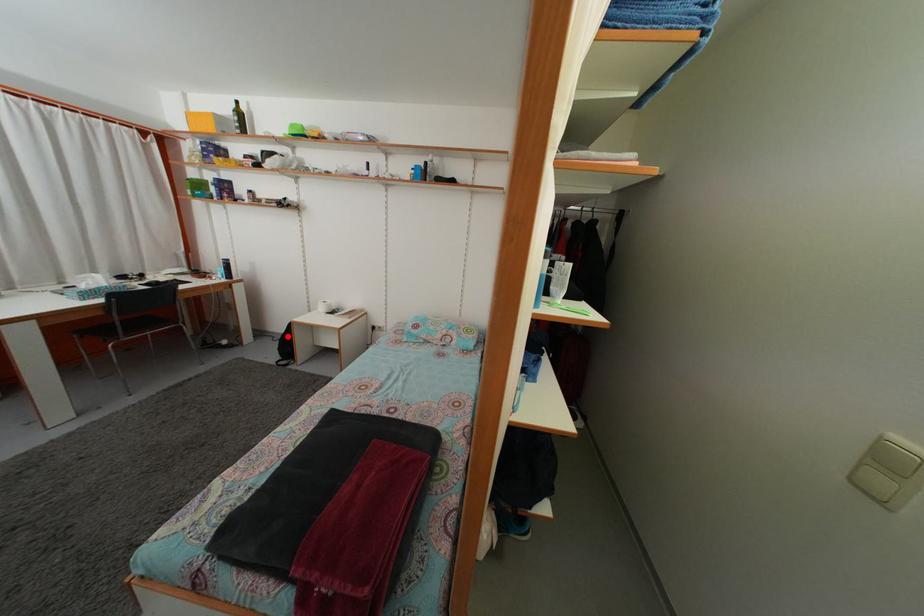
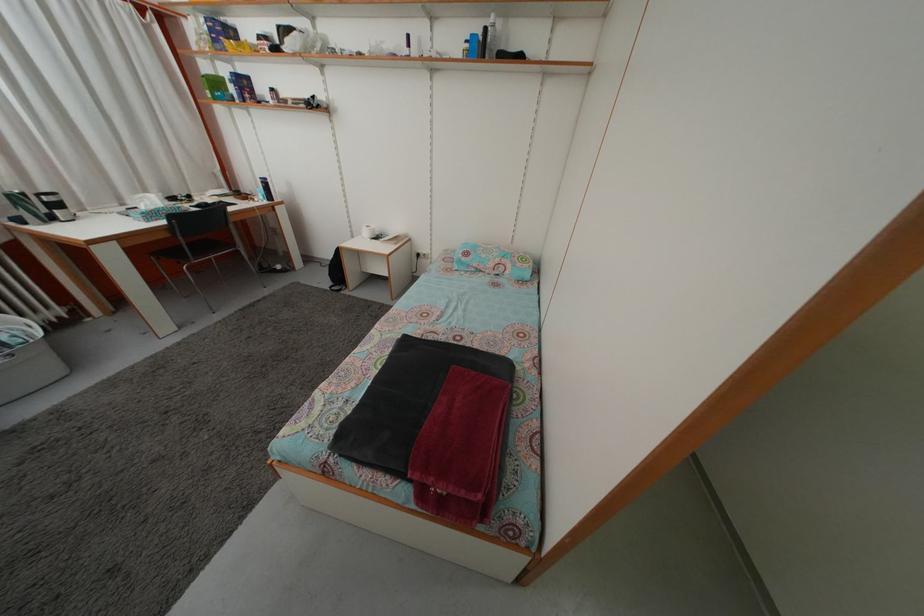
Question: A red point is marked in image1. In image2, is the corresponding 3D point closer to the camera or farther? Reply with the corresponding letter.

Choices:
 (A) The corresponding 3D point is closer.
 (B) The corresponding 3D point is farther.

Answer: (A)